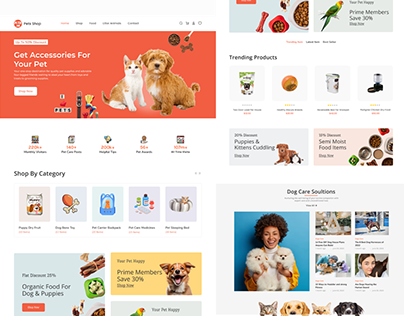
The image size is (404, 316). In order to click on nest style dog or cat bed in this screenshot , I will do `click(172, 203)`.